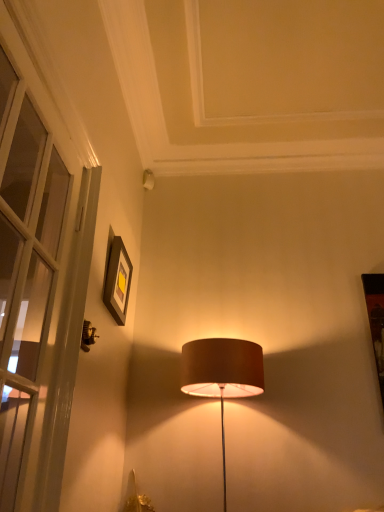
The height and width of the screenshot is (512, 384). What do you see at coordinates (25, 267) in the screenshot?
I see `white glass door at left` at bounding box center [25, 267].

The image size is (384, 512). I want to click on white glass door at left, so click(x=25, y=267).

Measure the distance between point (18, 378) and camera.

They are 3.51 feet apart.

What do you see at coordinates (118, 281) in the screenshot? The image size is (384, 512). I see `matte black picture frame at upper left` at bounding box center [118, 281].

Measure the distance between matte black picture frame at upper left and camera.

A distance of 1.84 meters exists between matte black picture frame at upper left and camera.

Locate an element on the screen. matte black picture frame at upper left is located at coordinates (118, 281).

The image size is (384, 512). In order to click on white glass door at left in this screenshot , I will do `click(25, 267)`.

Does matte black picture frame at upper left appear on the right side of white glass door at left?

Yes.

In the image, is matte black picture frame at upper left positioned in front of or behind white glass door at left?

In the image, matte black picture frame at upper left appears behind white glass door at left.

From the picture: Which is further, (121, 303) or (2, 371)?

The point (121, 303) is farther from the camera.

From the image's perspective, is matte black picture frame at upper left located beneath white glass door at left?

Correct, matte black picture frame at upper left appears lower than white glass door at left in the image.

Consider the image. From a real-world perspective, is matte black picture frame at upper left physically below white glass door at left?

Incorrect, from a real-world perspective, matte black picture frame at upper left is higher than white glass door at left.

Which of these two, matte black picture frame at upper left or white glass door at left, is wider?

white glass door at left is wider.

Considering the sizes of matte black picture frame at upper left and white glass door at left in the image, is matte black picture frame at upper left taller or shorter than white glass door at left?

matte black picture frame at upper left is shorter than white glass door at left.

Is matte black picture frame at upper left smaller than white glass door at left?

Yes.

Is matte black picture frame at upper left inside the boundaries of white glass door at left, or outside?

matte black picture frame at upper left is not enclosed by white glass door at left.

Are matte black picture frame at upper left and white glass door at left located far from each other?

That's not correct — matte black picture frame at upper left is a little close to white glass door at left.

Is matte black picture frame at upper left oriented towards white glass door at left?

No, matte black picture frame at upper left is not facing towards white glass door at left.

At what (x,y) coordinates should I click in order to perform the action: click on picture frame that appears behind the white glass door at left. Please return your answer as a coordinate pair (x, y). This screenshot has width=384, height=512. Looking at the image, I should click on (118, 281).

Which is more to the left, white glass door at left or matte black picture frame at upper left?

Positioned to the left is white glass door at left.

Relative to matte black picture frame at upper left, is white glass door at left in front or behind?

Visually, white glass door at left is located in front of matte black picture frame at upper left.

Is point (31, 387) closer or farther from the camera than point (123, 325)?

Point (31, 387) is positioned closer to the camera compared to point (123, 325).

Based on the photo, from the image's perspective, is white glass door at left below matte black picture frame at upper left?

No, from the image's perspective, white glass door at left is not below matte black picture frame at upper left.

Based on the photo, from a real-world perspective, which object stands above the other?

matte black picture frame at upper left, from a real-world perspective.

Between white glass door at left and matte black picture frame at upper left, which one has smaller width?

With smaller width is matte black picture frame at upper left.

Which of these two, white glass door at left or matte black picture frame at upper left, stands shorter?

Standing shorter between the two is matte black picture frame at upper left.

Who is smaller, white glass door at left or matte black picture frame at upper left?

matte black picture frame at upper left.

Is white glass door at left situated inside matte black picture frame at upper left or outside?

The correct answer is: outside.

Is white glass door at left placed right next to matte black picture frame at upper left?

white glass door at left is not next to matte black picture frame at upper left, and they're not touching.

Is white glass door at left facing towards matte black picture frame at upper left?

No, white glass door at left is not facing towards matte black picture frame at upper left.

How different are the orientations of white glass door at left and matte black picture frame at upper left in degrees?

There is a 4.32-degree angle between the facing directions of white glass door at left and matte black picture frame at upper left.

In order to click on picture frame below the white glass door at left (from the image's perspective) in this screenshot , I will do `click(118, 281)`.

The width and height of the screenshot is (384, 512). Find the location of `window below the matte black picture frame at upper left (from a real-world perspective)`. window below the matte black picture frame at upper left (from a real-world perspective) is located at coordinates (25, 267).

Where is `picture frame located above the white glass door at left (from a real-world perspective)`? picture frame located above the white glass door at left (from a real-world perspective) is located at coordinates (118, 281).